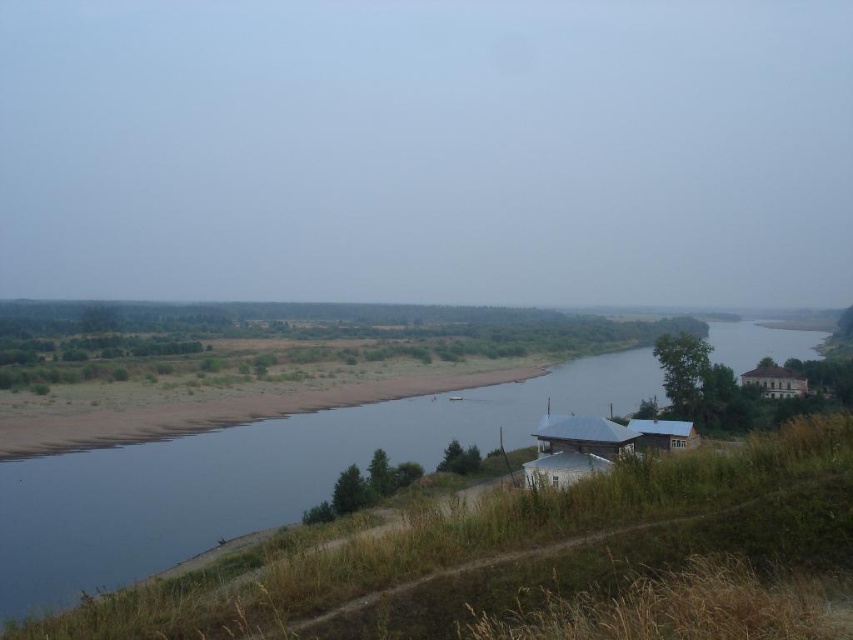
Question: Which object is the farthest from the blue water at center?

Choices:
 (A) white wooden house at right
 (B) blue corrugated metal hut at lower right

Answer: (B)

Question: Which point is farther from the camera taking this photo?

Choices:
 (A) (607, 445)
 (B) (802, 390)

Answer: (B)

Question: In this image, where is blue water at center located relative to blue corrugated metal hut at lower right?

Choices:
 (A) above
 (B) below

Answer: (B)

Question: Is white wooden hut at lower center bigger than blue corrugated metal hut at lower right?

Choices:
 (A) no
 (B) yes

Answer: (A)

Question: Does white wooden hut at lower center have a smaller size compared to blue corrugated metal hut at lower right?

Choices:
 (A) no
 (B) yes

Answer: (B)

Question: Which object is farther from the camera taking this photo?

Choices:
 (A) white wooden hut at lower center
 (B) blue water at center
 (C) white wooden house at right

Answer: (C)